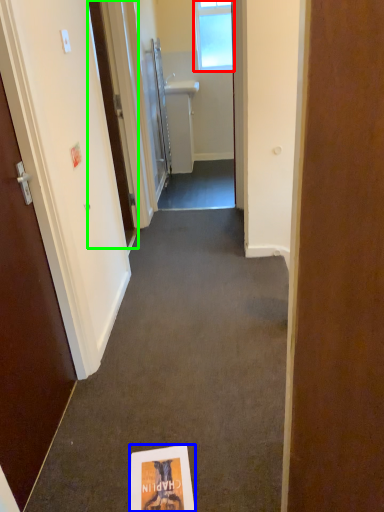
Question: Which is nearer to the window (highlighted by a red box)? flyer (highlighted by a blue box) or door (highlighted by a green box).

Choices:
 (A) flyer
 (B) door

Answer: (B)